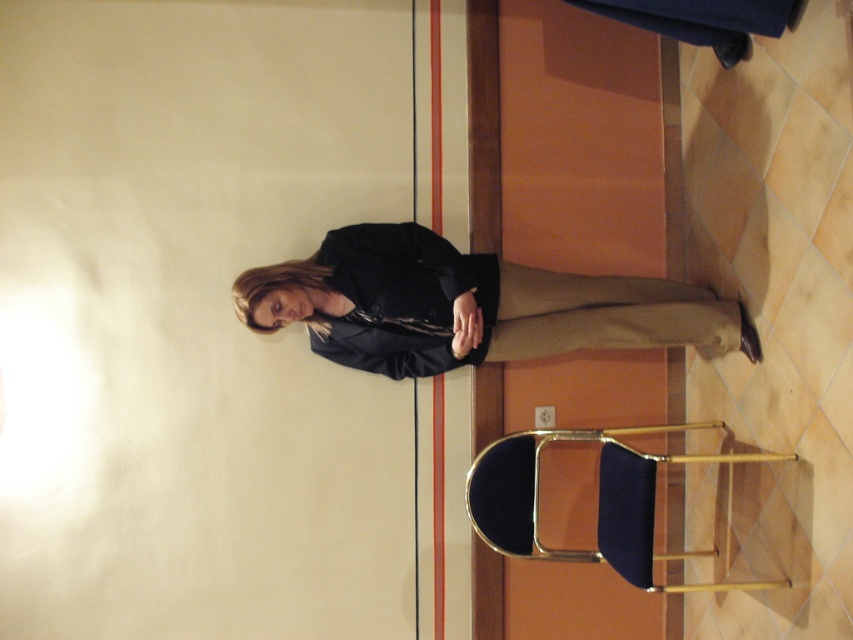
Please provide the coordinates of the matte black blazer at center in the image. The coordinate system is defined as follows. The origin is at the bottom left corner of the image. The x axis goes to the right, and the y axis goes upward. The coordinates are normalized between 0 and 1.

The coordinates of the matte black blazer at center are at point 0.478 in the x axis and 0.572 in the y axis.

You are organizing a small event and need to arrange seating for attendees. You have a matte black blazer at center and a velvet blue chair at lower right available. Which item takes up more physical space?

The velvet blue chair at lower right takes up more physical space than the matte black blazer at center, as the matte black blazer at center occupies less space than velvet blue chair at lower right.

You are an interior designer analyzing the color scheme of the room. The point at coordinates (486, 305) is where the matte black blazer at center is located. Considering the wall colors, which include a horizontal red stripe and an orange section below it, how does the matte black blazer at center visually interact with the wall colors?

The matte black blazer at center contrasts with the red and orange wall colors, creating a bold and sophisticated visual interaction.